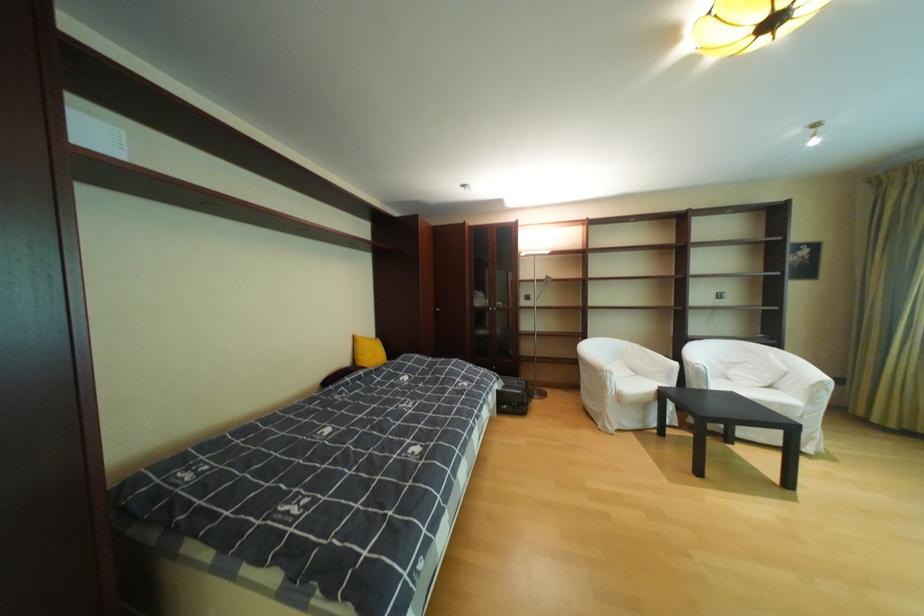
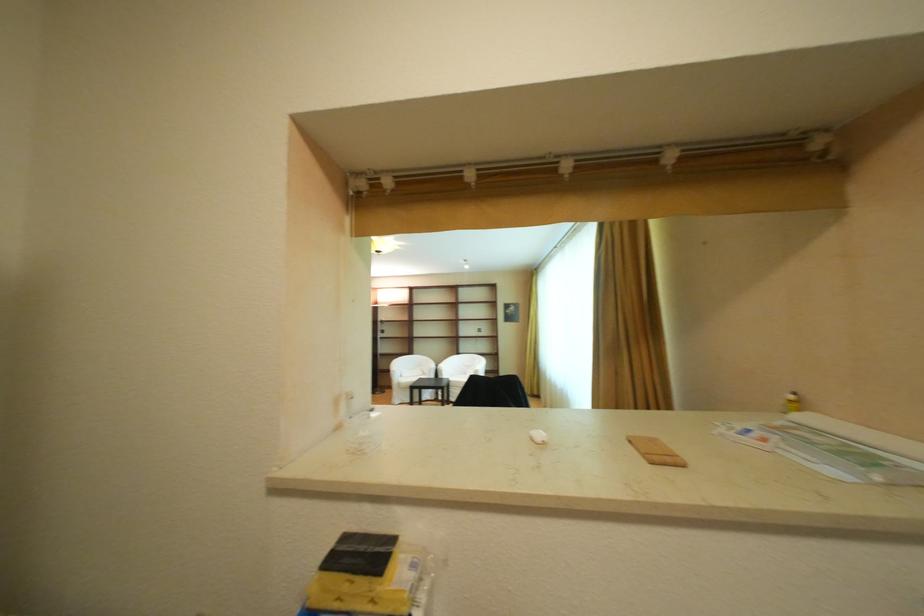
Which direction would the cameraman need to move to produce the second image?

The movement direction of the cameraman is right, backward.